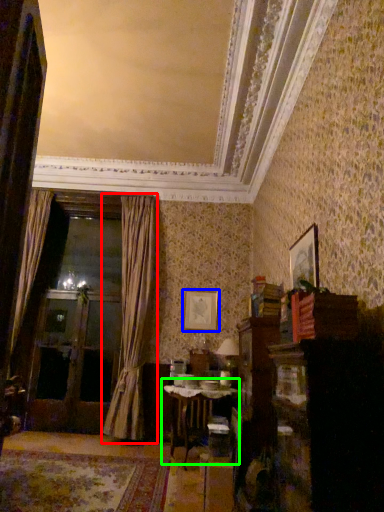
Question: Which object is the farthest from curtain (highlighted by a red box)? Choose among these: picture frame (highlighted by a blue box) or table (highlighted by a green box).

Choices:
 (A) picture frame
 (B) table

Answer: (B)